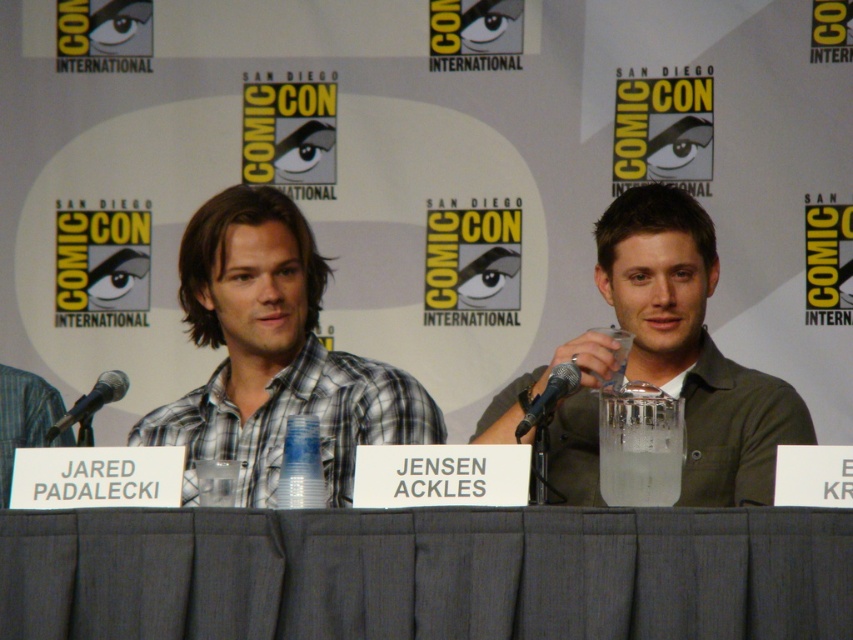
You are attending a panel at San Diego Comic Con and see the clear glass cup at center and the black metallic microphone at center on the table. Which object is located to the right of the other?

The clear glass cup at center is positioned on the right side of black metallic microphone at center.

You are attending a panel at San Diego Comic Con and see the matte green shirt at center and the clear glass cup at center on the table. Which object is closer to the right edge of the table?

The matte green shirt at center is positioned on the right side of the clear glass cup at center, so it is closer to the right edge of the table.

You are attending San Diego Comic Con and see a panel discussion with two people seated behind a table. You notice a matte green shirt at center and a clear glass cup at center. Which object is taller?

The matte green shirt at center is taller than the clear glass cup at center.